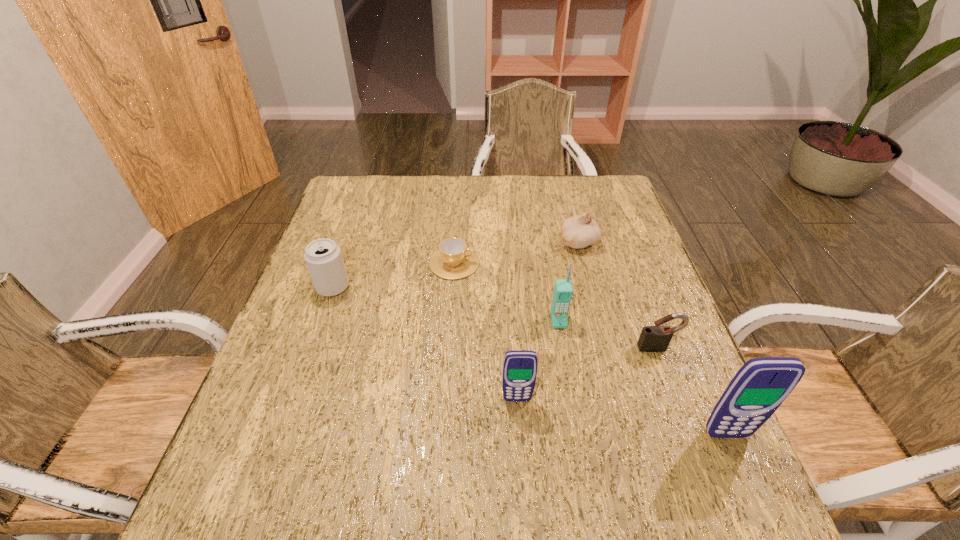
I want to click on free space between the can and the third nearest object, so tap(495, 318).

This screenshot has height=540, width=960. Find the location of `free space between the nearest cellular telephone and the cup`. free space between the nearest cellular telephone and the cup is located at coordinates (590, 349).

The width and height of the screenshot is (960, 540). Find the location of `free space between the can and the sixth farthest object`. free space between the can and the sixth farthest object is located at coordinates (425, 343).

Where is `vacant area between the fourth object from right to left and the shortest object`? The image size is (960, 540). vacant area between the fourth object from right to left and the shortest object is located at coordinates (506, 292).

This screenshot has height=540, width=960. Find the location of `free point between the third nearest object and the farthest cellular telephone`. free point between the third nearest object and the farthest cellular telephone is located at coordinates (608, 334).

Locate an element on the screen. free spot between the second object from left to right and the second cellular telephone from left to right is located at coordinates click(x=506, y=292).

The width and height of the screenshot is (960, 540). What are the coordinates of `free spot between the second nearest object and the fifth object from left to right` in the screenshot? It's located at (548, 321).

Locate which object ranks in proximity to the sixth object from right to left. Please provide its 2D coordinates. Your answer should be formatted as a tuple, i.e. [(x, y)], where the tuple contains the x and y coordinates of a point satisfying the conditions above.

[(323, 257)]

Identify which object is the fifth closest to the farthest cellular telephone. Please provide its 2D coordinates. Your answer should be formatted as a tuple, i.e. [(x, y)], where the tuple contains the x and y coordinates of a point satisfying the conditions above.

[(761, 385)]

Locate an element on the screen. This screenshot has height=540, width=960. cellular telephone identified as the second closest to the second nearest cellular telephone is located at coordinates (761, 385).